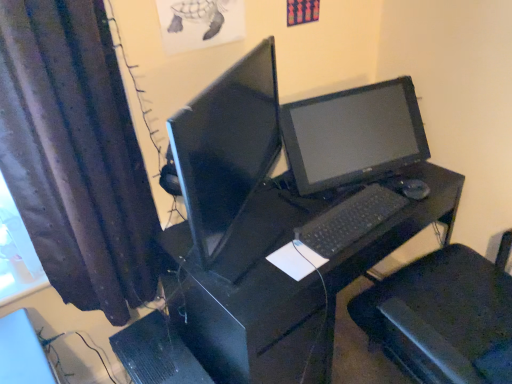
Image resolution: width=512 pixels, height=384 pixels. I want to click on empty space that is to the right of white paper at center, so click(x=331, y=242).